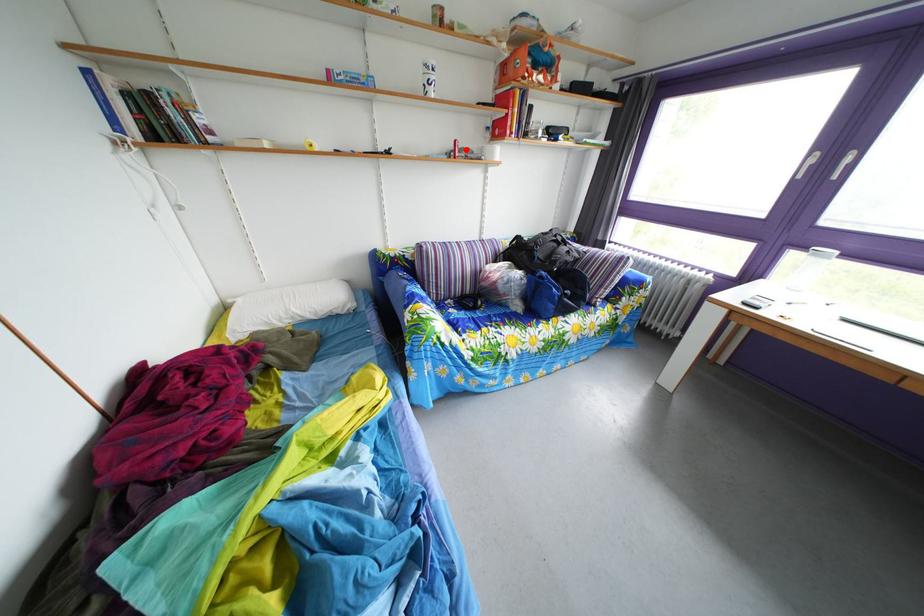
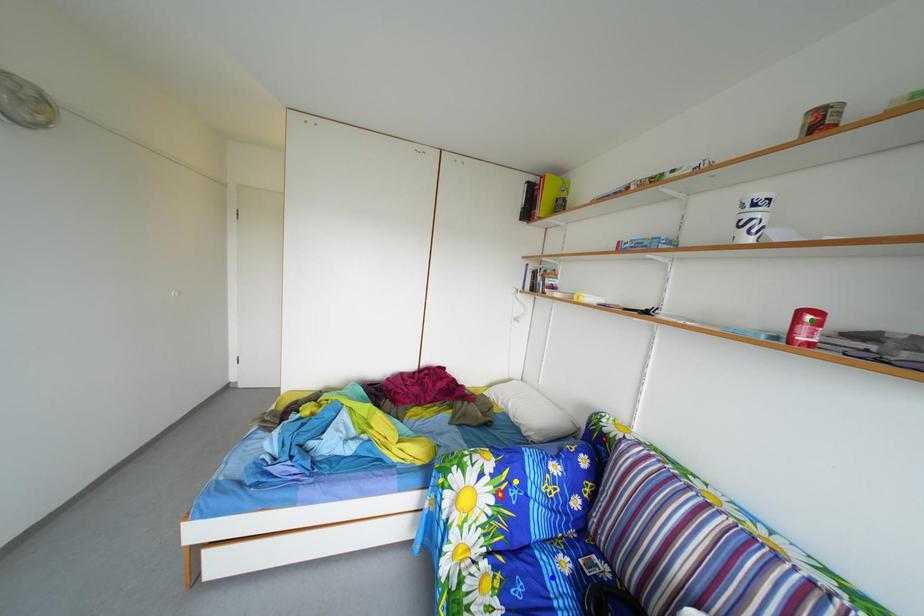
Question: I am providing you with two images of the same scene from different viewpoints. A red point is marked on the first image. You are given multiple points on the second image. Which point in image 2 is actually the same real-world point as the red point in image 1?

Choices:
 (A) green point
 (B) blue point
 (C) yellow point

Answer: (A)